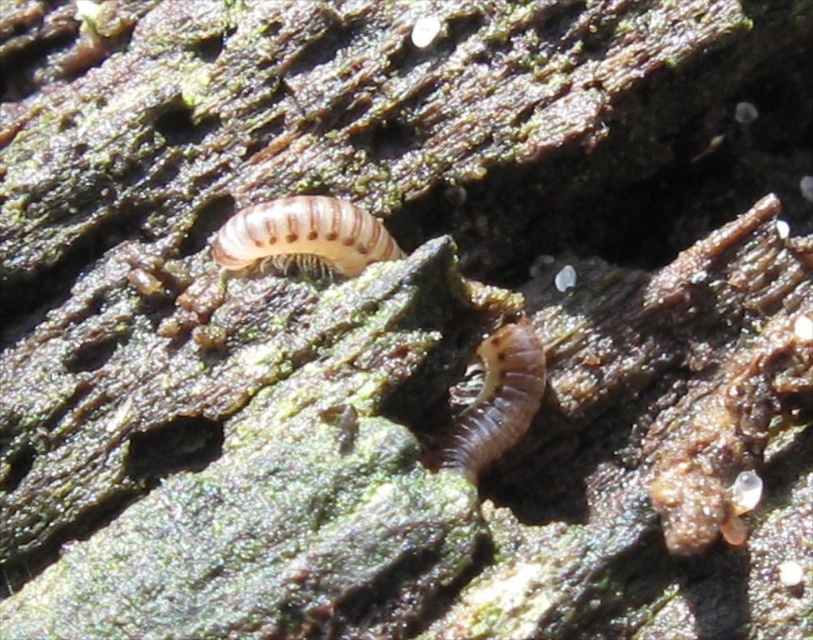
Question: Can you confirm if light brown striped millipede at center is smaller than brown matte worm at center?

Choices:
 (A) no
 (B) yes

Answer: (B)

Question: Can you confirm if light brown striped millipede at center is wider than brown matte worm at center?

Choices:
 (A) no
 (B) yes

Answer: (B)

Question: Which of the following is the farthest from the observer?

Choices:
 (A) light brown striped millipede at center
 (B) brown matte worm at center

Answer: (A)

Question: Does light brown striped millipede at center have a greater width compared to brown matte worm at center?

Choices:
 (A) no
 (B) yes

Answer: (B)

Question: Which point is closer to the camera taking this photo?

Choices:
 (A) (533, 362)
 (B) (337, 266)

Answer: (A)